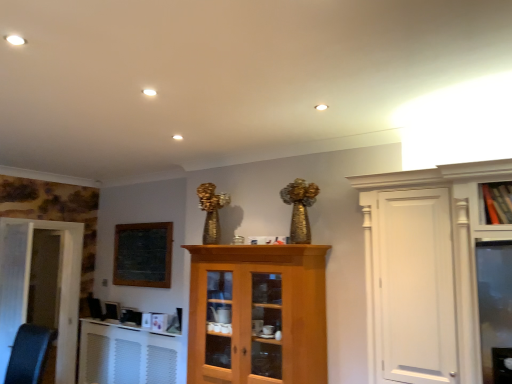
What do you see at coordinates (13, 284) in the screenshot? The image size is (512, 384). I see `white matte door at left, marked as the second door in a back-to-front arrangement` at bounding box center [13, 284].

Describe the element at coordinates (41, 287) in the screenshot. This screenshot has width=512, height=384. I see `white glossy door at left, which appears as the first door when viewed from the back` at that location.

Measure the distance between white glossy door at left, which appears as the first door when viewed from the back, and camera.

white glossy door at left, which appears as the first door when viewed from the back, is 4.79 meters away from camera.

The image size is (512, 384). Describe the element at coordinates (497, 202) in the screenshot. I see `wooden cabinet at upper right` at that location.

Locate an element on the screen. The image size is (512, 384). wooden cabinet at upper right is located at coordinates (497, 202).

Locate an element on the screen. This screenshot has height=384, width=512. black leather swivel chair at lower left is located at coordinates (29, 354).

Consider the image. Between white textured radiator at lower left and wooden cabinet at upper right, which one is positioned behind?

white textured radiator at lower left is further from the camera.

Where is `table that appears behind the wooden cabinet at upper right`? This screenshot has width=512, height=384. table that appears behind the wooden cabinet at upper right is located at coordinates (126, 355).

From a real-world perspective, is white textured radiator at lower left positioned above or below wooden cabinet at upper right?

From a real-world perspective, white textured radiator at lower left is physically below wooden cabinet at upper right.

From their relative heights in the image, would you say white textured radiator at lower left is taller or shorter than wooden cabinet at upper right?

Considering their sizes, white textured radiator at lower left has more height than wooden cabinet at upper right.

Can you confirm if black leather swivel chair at lower left is thinner than wooden cabinet at upper right?

Incorrect, the width of black leather swivel chair at lower left is not less than that of wooden cabinet at upper right.

Is black leather swivel chair at lower left shorter than wooden cabinet at upper right?

Incorrect, the height of black leather swivel chair at lower left does not fall short of that of wooden cabinet at upper right.

Which is behind, point (15, 348) or point (509, 201)?

The point (15, 348) is more distant.

Would you say white glossy door at left, which appears as the first door when viewed from the back, is outside black leather swivel chair at lower left?

Indeed, white glossy door at left, which appears as the first door when viewed from the back, is completely outside black leather swivel chair at lower left.

Based on their positions, is white glossy door at left, which is the 2th door in front-to-back order, located to the left or right of black leather swivel chair at lower left?

In the image, white glossy door at left, which is the 2th door in front-to-back order, appears on the left side of black leather swivel chair at lower left.

The height and width of the screenshot is (384, 512). I want to click on door below the black leather swivel chair at lower left (from the image's perspective), so click(x=41, y=287).

What's the angular difference between white glossy door at left, which is the 2th door in front-to-back order, and black leather swivel chair at lower left's facing directions?

The angle between the facing direction of white glossy door at left, which is the 2th door in front-to-back order, and the facing direction of black leather swivel chair at lower left is 86.3 degrees.

Which object is further away from the camera taking this photo, black leather swivel chair at lower left or white matte door at left, which is the first door from front to back?

white matte door at left, which is the first door from front to back.

From the image's perspective, which object appears higher, black leather swivel chair at lower left or white matte door at left, marked as the second door in a back-to-front arrangement?

white matte door at left, marked as the second door in a back-to-front arrangement, is shown above in the image.

Is black leather swivel chair at lower left bigger than white matte door at left, which is the first door from front to back?

No.

Is black leather swivel chair at lower left placed right next to white matte door at left, marked as the second door in a back-to-front arrangement?

black leather swivel chair at lower left and white matte door at left, marked as the second door in a back-to-front arrangement, are clearly separated.

The width and height of the screenshot is (512, 384). What are the coordinates of `swivel chair below the wooden cabinet at center (from the image's perspective)` in the screenshot? It's located at (29, 354).

Considering the relative sizes of black leather swivel chair at lower left and wooden cabinet at center in the image provided, is black leather swivel chair at lower left wider than wooden cabinet at center?

Indeed, black leather swivel chair at lower left has a greater width compared to wooden cabinet at center.

In terms of height, does black leather swivel chair at lower left look taller or shorter compared to wooden cabinet at center?

Considering their sizes, black leather swivel chair at lower left has less height than wooden cabinet at center.

Which object is positioned more to the left, black leather swivel chair at lower left or wooden cabinet at center?

black leather swivel chair at lower left is more to the left.

Is point (146, 360) closer to viewer compared to point (40, 328)?

No, it is not.

Where is `table directly beneath the black leather swivel chair at lower left (from a real-world perspective)`? table directly beneath the black leather swivel chair at lower left (from a real-world perspective) is located at coordinates (126, 355).

From the image's perspective, which is above, white textured radiator at lower left or black leather swivel chair at lower left?

black leather swivel chair at lower left, from the image's perspective.

Between white textured radiator at lower left and white matte door at left, which is the first door from front to back, which one is positioned behind?

white textured radiator at lower left is more distant.

Does white textured radiator at lower left have a smaller size compared to white matte door at left, which is the first door from front to back?

No, white textured radiator at lower left is not smaller than white matte door at left, which is the first door from front to back.

From a real-world perspective, is white textured radiator at lower left positioned above or below white matte door at left, marked as the second door in a back-to-front arrangement?

In terms of real-world spatial position, white textured radiator at lower left is below white matte door at left, marked as the second door in a back-to-front arrangement.

From the image's perspective, which object appears higher, white textured radiator at lower left or white matte door at left, which is the first door from front to back?

white matte door at left, which is the first door from front to back, from the image's perspective.

The image size is (512, 384). What are the coordinates of `table that appears below the wooden cabinet at upper right (from the image's perspective)` in the screenshot? It's located at (126, 355).

You are a GUI agent. You are given a task and a screenshot of the screen. Output one action in this format:
    pyautogui.click(x=<x>, y=<y>)
    Task: Click on the swivel chair on the left of wooden cabinet at upper right
    Image resolution: width=512 pixels, height=384 pixels.
    Given the screenshot: What is the action you would take?
    pyautogui.click(x=29, y=354)

Estimate the real-world distances between objects in this image. Which object is further from wooden cabinet at center, white matte door at left, marked as the second door in a back-to-front arrangement, or wooden cabinet at upper right?

The object further to wooden cabinet at center is white matte door at left, marked as the second door in a back-to-front arrangement.

Considering their positions, is white glossy door at left, which is the 2th door in front-to-back order, positioned closer to black leather swivel chair at lower left than white textured radiator at lower left?

Among the two, white textured radiator at lower left is located nearer to black leather swivel chair at lower left.

Estimate the real-world distances between objects in this image. Which object is further from white matte door at left, which is the first door from front to back, wooden cabinet at center or white glossy door at left, which is the 2th door in front-to-back order?

wooden cabinet at center lies further to white matte door at left, which is the first door from front to back, than the other object.

Considering their positions, is black leather swivel chair at lower left positioned further to white textured radiator at lower left than wooden cabinet at upper right?

The object further to white textured radiator at lower left is wooden cabinet at upper right.

Estimate the real-world distances between objects in this image. Which object is further from white textured radiator at lower left, white glossy door at left, which appears as the first door when viewed from the back, or white matte door at left, which is the first door from front to back?

Among the two, white matte door at left, which is the first door from front to back, is located further to white textured radiator at lower left.

Which object lies nearer to the anchor point wooden cabinet at center, white glossy door at left, which appears as the first door when viewed from the back, or white matte door at left, which is the first door from front to back?

white matte door at left, which is the first door from front to back.

When comparing their distances from black leather swivel chair at lower left, does wooden cabinet at upper right or wooden cabinet at center seem closer?

Among the two, wooden cabinet at center is located nearer to black leather swivel chair at lower left.

Based on their spatial positions, is wooden cabinet at upper right or wooden cabinet at center closer to white matte door at left, which is the first door from front to back?

wooden cabinet at center lies closer to white matte door at left, which is the first door from front to back, than the other object.

Identify the location of cupboard between black leather swivel chair at lower left and wooden cabinet at upper right from left to right. (257, 314).

This screenshot has height=384, width=512. Identify the location of cupboard situated between white textured radiator at lower left and wooden cabinet at upper right from left to right. (257, 314).

At what (x,y) coordinates should I click in order to perform the action: click on cupboard between white glossy door at left, which appears as the first door when viewed from the back, and wooden cabinet at upper right. Please return your answer as a coordinate pair (x, y). The width and height of the screenshot is (512, 384). Looking at the image, I should click on (257, 314).

Locate an element on the screen. table between black leather swivel chair at lower left and white glossy door at left, which is the 2th door in front-to-back order, in the front-back direction is located at coordinates (126, 355).